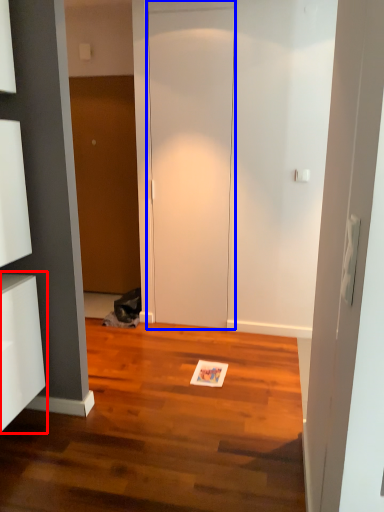
Question: Among these objects, which one is nearest to the camera, cabinetry (highlighted by a red box) or door (highlighted by a blue box)?

Choices:
 (A) cabinetry
 (B) door

Answer: (A)